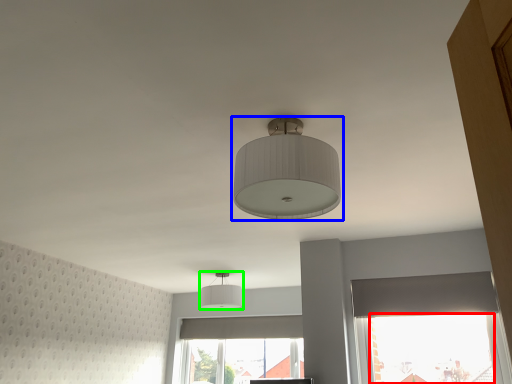
Question: Considering the real-world distances, which object is farthest from window screen (highlighted by a red box)? lamp (highlighted by a blue box) or lamp (highlighted by a green box)?

Choices:
 (A) lamp
 (B) lamp

Answer: (A)